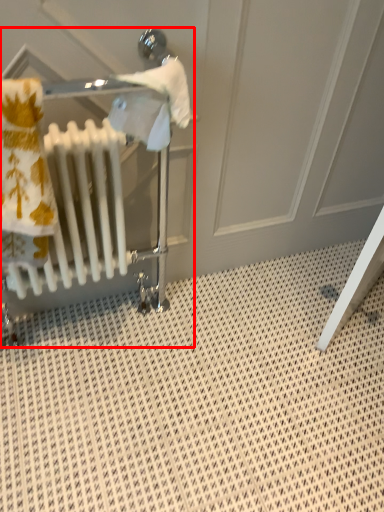
Question: From the image, what is the correct spatial relationship of baby carriage (annotated by the red box) in relation to radiator?

Choices:
 (A) left
 (B) right

Answer: (B)